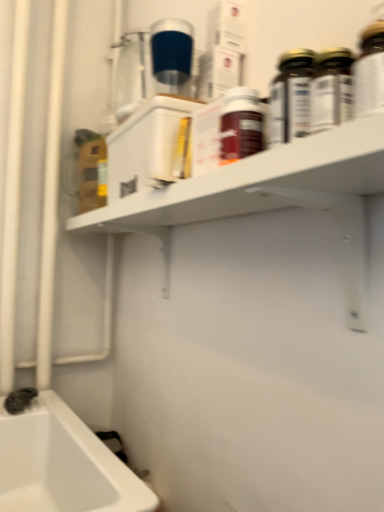
This screenshot has width=384, height=512. I want to click on black rubber faucet at lower left, so click(19, 400).

The width and height of the screenshot is (384, 512). Describe the element at coordinates (290, 97) in the screenshot. I see `gold metallic bottle at upper right, the 2th bottle in the left-to-right sequence` at that location.

What do you see at coordinates (271, 198) in the screenshot? I see `white matte shelf at upper center` at bounding box center [271, 198].

Where is `black rubber faucet at lower left`? The image size is (384, 512). black rubber faucet at lower left is located at coordinates (19, 400).

In terms of height, does gold metallic bottle at upper right, positioned as the 1th bottle in right-to-left order, look taller or shorter compared to matte brown bottle at center, which ranks as the first bottle in front-to-back order?

gold metallic bottle at upper right, positioned as the 1th bottle in right-to-left order, is shorter than matte brown bottle at center, which ranks as the first bottle in front-to-back order.

In terms of size, does gold metallic bottle at upper right, the 2th bottle in the left-to-right sequence, appear bigger or smaller than matte brown bottle at center, which is the second bottle in back-to-front order?

Considering their sizes, gold metallic bottle at upper right, the 2th bottle in the left-to-right sequence, takes up less space than matte brown bottle at center, which is the second bottle in back-to-front order.

Does gold metallic bottle at upper right, the 2th bottle in the left-to-right sequence, have a greater width compared to matte brown bottle at center, which is the first bottle in bottom-to-top order?

No, gold metallic bottle at upper right, the 2th bottle in the left-to-right sequence, is not wider than matte brown bottle at center, which is the first bottle in bottom-to-top order.

From a real-world perspective, is matte brown bottle at center, which is the first bottle in bottom-to-top order, located higher than black rubber faucet at lower left?

Yes, from a real-world perspective, matte brown bottle at center, which is the first bottle in bottom-to-top order, is on top of black rubber faucet at lower left.

Would you say matte brown bottle at center, which is the second bottle in back-to-front order, contains black rubber faucet at lower left?

No, black rubber faucet at lower left is located outside of matte brown bottle at center, which is the second bottle in back-to-front order.

From the image's perspective, which one is positioned higher, matte brown bottle at center, acting as the 2th bottle starting from the top, or black rubber faucet at lower left?

matte brown bottle at center, acting as the 2th bottle starting from the top, is shown above in the image.

Considering the positions of objects gold metallic bottle at upper right, the 2th bottle when ordered from front to back, and black rubber faucet at lower left in the image provided, who is more to the left, gold metallic bottle at upper right, the 2th bottle when ordered from front to back, or black rubber faucet at lower left?

black rubber faucet at lower left.

Considering the relative sizes of gold metallic bottle at upper right, which appears as the 1th bottle when viewed from the back, and black rubber faucet at lower left in the image provided, is gold metallic bottle at upper right, which appears as the 1th bottle when viewed from the back, wider than black rubber faucet at lower left?

In fact, gold metallic bottle at upper right, which appears as the 1th bottle when viewed from the back, might be narrower than black rubber faucet at lower left.

Is gold metallic bottle at upper right, positioned as the 1th bottle in right-to-left order, further to camera compared to black rubber faucet at lower left?

No.

From the image's perspective, which one is positioned lower, gold metallic bottle at upper right, the 2th bottle in the left-to-right sequence, or black rubber faucet at lower left?

black rubber faucet at lower left.

Who is smaller, matte brown bottle at center, which ranks as the first bottle in front-to-back order, or gold metallic bottle at upper right, the 2th bottle from the bottom?

gold metallic bottle at upper right, the 2th bottle from the bottom.

From a real-world perspective, who is located lower, matte brown bottle at center, which is the first bottle in bottom-to-top order, or gold metallic bottle at upper right, the 2th bottle from the bottom?

matte brown bottle at center, which is the first bottle in bottom-to-top order, from a real-world perspective.

Looking at this image, can you tell me how much matte brown bottle at center, acting as the 2th bottle starting from the top, and gold metallic bottle at upper right, which appears as the 1th bottle when viewed from the back, differ in facing direction?

The angular difference between matte brown bottle at center, acting as the 2th bottle starting from the top, and gold metallic bottle at upper right, which appears as the 1th bottle when viewed from the back, is 5.85 degrees.

Considering the positions of points (253, 121) and (268, 118), is point (253, 121) farther from camera compared to point (268, 118)?

Yes, it is behind point (268, 118).

Is the surface of gold metallic bottle at upper right, the 2th bottle when ordered from front to back, in direct contact with white matte shelf at upper center?

gold metallic bottle at upper right, the 2th bottle when ordered from front to back, and white matte shelf at upper center are not in contact.

Is point (281, 128) farther from viewer compared to point (158, 223)?

No, (281, 128) is in front of (158, 223).

Identify the location of shelf below the gold metallic bottle at upper right, arranged as the first bottle when viewed from the top (from a real-world perspective). (271, 198).

From a real-world perspective, is gold metallic bottle at upper right, the 2th bottle from the bottom, on white matte shelf at upper center?

Yes, from a real-world perspective, gold metallic bottle at upper right, the 2th bottle from the bottom, is on top of white matte shelf at upper center.

From the image's perspective, is black rubber faucet at lower left above or below gold metallic bottle at upper right, arranged as the first bottle when viewed from the top?

From the image's perspective, black rubber faucet at lower left appears below gold metallic bottle at upper right, arranged as the first bottle when viewed from the top.

Is black rubber faucet at lower left to the left of gold metallic bottle at upper right, arranged as the first bottle when viewed from the top, from the viewer's perspective?

Yes.

From the picture: How different are the orientations of black rubber faucet at lower left and gold metallic bottle at upper right, which appears as the 1th bottle when viewed from the back, in degrees?

There is a 51.5-degree angle between the facing directions of black rubber faucet at lower left and gold metallic bottle at upper right, which appears as the 1th bottle when viewed from the back.

How distant is black rubber faucet at lower left from gold metallic bottle at upper right, positioned as the 1th bottle in right-to-left order?

black rubber faucet at lower left and gold metallic bottle at upper right, positioned as the 1th bottle in right-to-left order, are 36.65 inches apart.

Between white matte shelf at upper center and matte brown bottle at center, the 1th bottle viewed from the left, which one appears on the right side from the viewer's perspective?

Positioned to the right is matte brown bottle at center, the 1th bottle viewed from the left.

Choose the correct answer: Is white matte shelf at upper center inside matte brown bottle at center, acting as the 2th bottle starting from the top, or outside it?

The correct answer is: outside.

From the image's perspective, which object appears higher, white matte shelf at upper center or matte brown bottle at center, which is the first bottle in bottom-to-top order?

matte brown bottle at center, which is the first bottle in bottom-to-top order, from the image's perspective.

Which of these two, white matte shelf at upper center or matte brown bottle at center, the 2th bottle when ordered from right to left, is bigger?

With larger size is white matte shelf at upper center.

Where is `bottle in front of the gold metallic bottle at upper right, the 2th bottle in the left-to-right sequence`? This screenshot has width=384, height=512. bottle in front of the gold metallic bottle at upper right, the 2th bottle in the left-to-right sequence is located at coordinates (240, 125).

At what (x,y) coordinates should I click in order to perform the action: click on plumbing fixture behind the matte brown bottle at center, the 2th bottle when ordered from right to left. Please return your answer as a coordinate pair (x, y). Looking at the image, I should click on (19, 400).

From the picture: Looking at the image, which one is located further to matte brown bottle at center, which is the first bottle in bottom-to-top order, black rubber faucet at lower left or white matte shelf at upper center?

black rubber faucet at lower left lies further to matte brown bottle at center, which is the first bottle in bottom-to-top order, than the other object.

When comparing their distances from gold metallic bottle at upper right, the 2th bottle when ordered from front to back, does black rubber faucet at lower left or white matte shelf at upper center seem closer?

Among the two, white matte shelf at upper center is located nearer to gold metallic bottle at upper right, the 2th bottle when ordered from front to back.

Based on their spatial positions, is black rubber faucet at lower left or matte brown bottle at center, which ranks as the first bottle in front-to-back order, closer to white matte shelf at upper center?

matte brown bottle at center, which ranks as the first bottle in front-to-back order, lies closer to white matte shelf at upper center than the other object.

When comparing their distances from matte brown bottle at center, which is the first bottle in bottom-to-top order, does gold metallic bottle at upper right, the 2th bottle from the bottom, or white matte shelf at upper center seem further?

white matte shelf at upper center lies further to matte brown bottle at center, which is the first bottle in bottom-to-top order, than the other object.

Estimate the real-world distances between objects in this image. Which object is closer to matte brown bottle at center, acting as the 2th bottle starting from the top, gold metallic bottle at upper right, the 2th bottle in the left-to-right sequence, or black rubber faucet at lower left?

gold metallic bottle at upper right, the 2th bottle in the left-to-right sequence, is positioned closer to the anchor matte brown bottle at center, acting as the 2th bottle starting from the top.

Considering their positions, is matte brown bottle at center, the 2th bottle when ordered from right to left, positioned closer to black rubber faucet at lower left than white matte shelf at upper center?

white matte shelf at upper center is closer to black rubber faucet at lower left.

Considering their positions, is black rubber faucet at lower left positioned closer to matte brown bottle at center, which is the first bottle in bottom-to-top order, than gold metallic bottle at upper right, the 2th bottle from the bottom?

Among the two, gold metallic bottle at upper right, the 2th bottle from the bottom, is located nearer to matte brown bottle at center, which is the first bottle in bottom-to-top order.

When comparing their distances from matte brown bottle at center, acting as the 2th bottle starting from the top, does white matte shelf at upper center or black rubber faucet at lower left seem further?

black rubber faucet at lower left is further to matte brown bottle at center, acting as the 2th bottle starting from the top.

Find the location of `bottle between white matte shelf at upper center and gold metallic bottle at upper right, which appears as the 1th bottle when viewed from the back, in the front-back direction`. bottle between white matte shelf at upper center and gold metallic bottle at upper right, which appears as the 1th bottle when viewed from the back, in the front-back direction is located at coordinates (240, 125).

The width and height of the screenshot is (384, 512). I want to click on bottle between gold metallic bottle at upper right, which appears as the 1th bottle when viewed from the back, and black rubber faucet at lower left vertically, so click(240, 125).